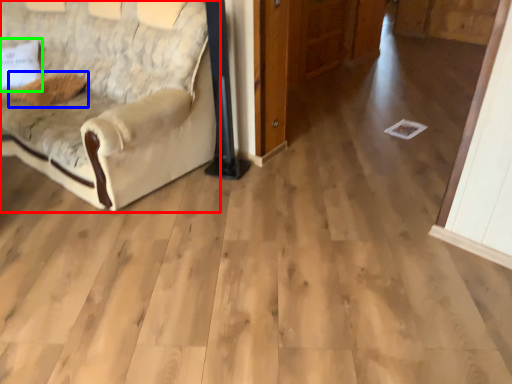
Question: Considering the real-world distances, which object is farthest from studio couch (highlighted by a red box)? pillow (highlighted by a blue box) or pillow (highlighted by a green box)?

Choices:
 (A) pillow
 (B) pillow

Answer: (B)